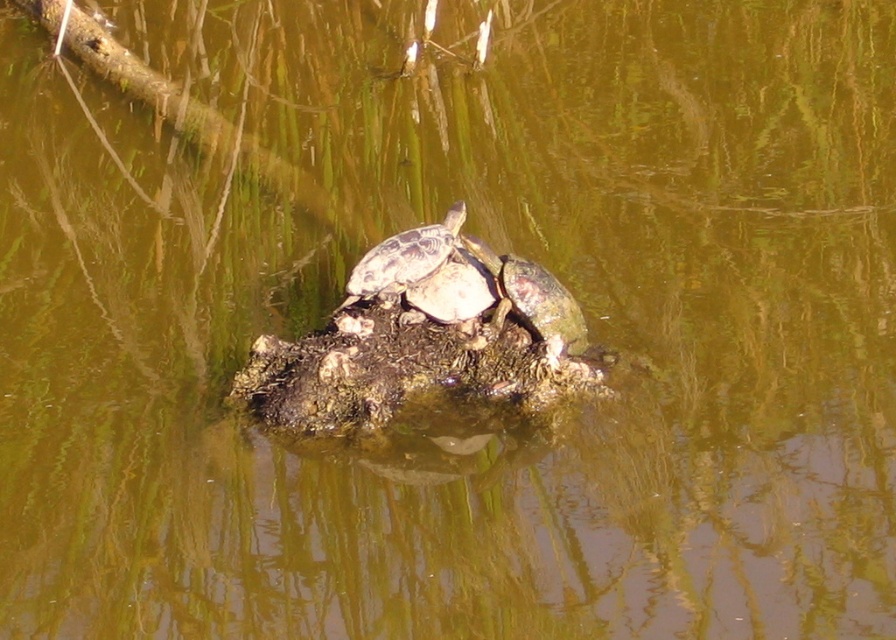
Does shiny brown tortoise at center have a greater width compared to smooth gray tortoise at center?

Correct, the width of shiny brown tortoise at center exceeds that of smooth gray tortoise at center.

Is shiny brown tortoise at center to the left of smooth gray tortoise at center from the viewer's perspective?

Correct, you'll find shiny brown tortoise at center to the left of smooth gray tortoise at center.

Is point (435, 241) positioned before point (466, 275)?

That is True.

Image resolution: width=896 pixels, height=640 pixels. What are the coordinates of `shiny brown tortoise at center` in the screenshot? It's located at (403, 260).

You are a GUI agent. You are given a task and a screenshot of the screen. Output one action in this format:
    pyautogui.click(x=<x>, y=<y>)
    Task: Click on the greenish-brown scaly tortoise at center
    This screenshot has width=896, height=640.
    Given the screenshot: What is the action you would take?
    (x=532, y=298)

This screenshot has height=640, width=896. Describe the element at coordinates (532, 298) in the screenshot. I see `greenish-brown scaly tortoise at center` at that location.

Between point (507, 259) and point (433, 262), which one is positioned in front?

Point (433, 262) is in front.

Find the location of a particular element. The image size is (896, 640). greenish-brown scaly tortoise at center is located at coordinates (532, 298).

Between greenish-brown scaly tortoise at center and smooth gray tortoise at center, which one is positioned lower?

greenish-brown scaly tortoise at center

How distant is greenish-brown scaly tortoise at center from smooth gray tortoise at center?

They are 5.05 inches apart.

Identify the location of greenish-brown scaly tortoise at center. The height and width of the screenshot is (640, 896). (532, 298).